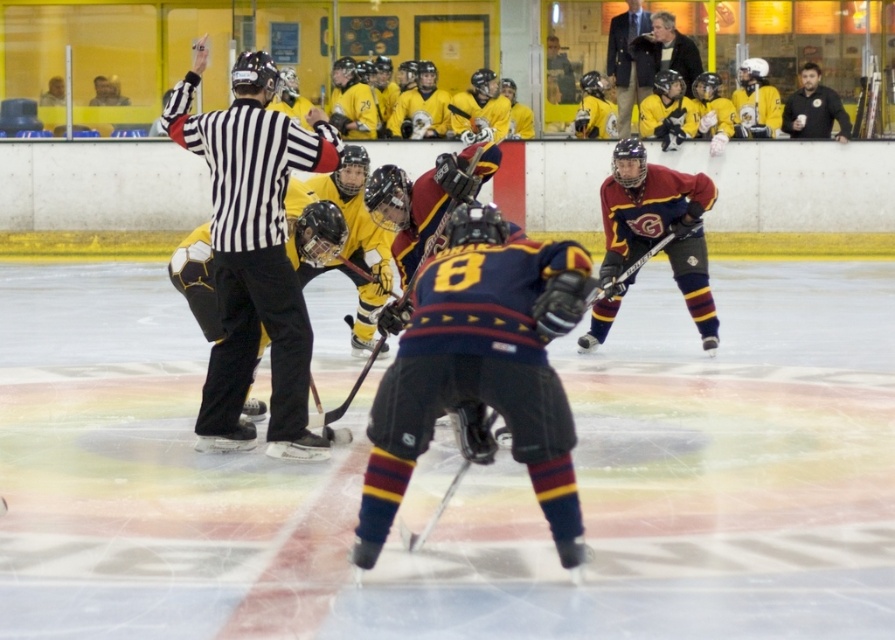
Is maroon jersey at center smaller than black matte hockey stick at center?

No, maroon jersey at center is not smaller than black matte hockey stick at center.

Does maroon jersey at center have a larger size compared to black matte hockey stick at center?

Yes.

Image resolution: width=895 pixels, height=640 pixels. Identify the location of maroon jersey at center. (658, 227).

Locate an element on the screen. maroon jersey at center is located at coordinates (658, 227).

Who is more forward, (462, 333) or (313, 397)?

Point (462, 333)

Between dark blue jersey at center and black matte hockey stick at center, which one is positioned lower?

black matte hockey stick at center

Is point (419, 429) less distant than point (331, 177)?

Yes, it is.

Find the location of a particular element. Image resolution: width=895 pixels, height=640 pixels. dark blue jersey at center is located at coordinates (482, 369).

Is point (339, 184) closer to viewer compared to point (837, 96)?

Yes, it is.

The height and width of the screenshot is (640, 895). Identify the location of black matte hockey stick at center. (343, 401).

Is point (480, 156) positioned behind point (812, 132)?

No, (480, 156) is closer to viewer.

You are a GUI agent. You are given a task and a screenshot of the screen. Output one action in this format:
    pyautogui.click(x=<x>, y=<y>)
    Task: Click on the black matte hockey stick at center
    The width and height of the screenshot is (895, 640).
    Given the screenshot: What is the action you would take?
    (343, 401)